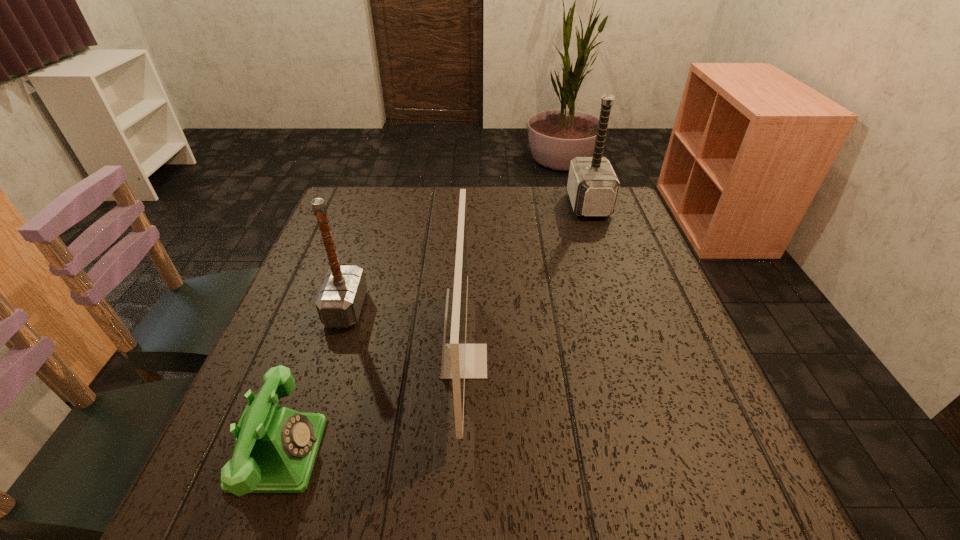
I want to click on vacant area located on the front-facing side of the monitor, so click(x=595, y=361).

The width and height of the screenshot is (960, 540). Identify the location of vacant space situated on the dial of the telephone. (543, 452).

This screenshot has height=540, width=960. Identify the location of object that is at the far edge. (593, 186).

Image resolution: width=960 pixels, height=540 pixels. Find the location of `object present at the near edge`. object present at the near edge is located at coordinates (275, 448).

Find the location of a particular element. The height and width of the screenshot is (540, 960). hammer situated at the left edge is located at coordinates (339, 302).

Where is `telephone present at the left edge`? The image size is (960, 540). telephone present at the left edge is located at coordinates (275, 448).

Locate an element on the screen. Image resolution: width=960 pixels, height=540 pixels. object at the right edge is located at coordinates [593, 186].

The height and width of the screenshot is (540, 960). I want to click on object that is at the near left corner, so pos(275,448).

The height and width of the screenshot is (540, 960). I want to click on object present at the far right corner, so click(x=593, y=186).

This screenshot has height=540, width=960. I want to click on vacant space at the far edge of the desktop, so click(516, 206).